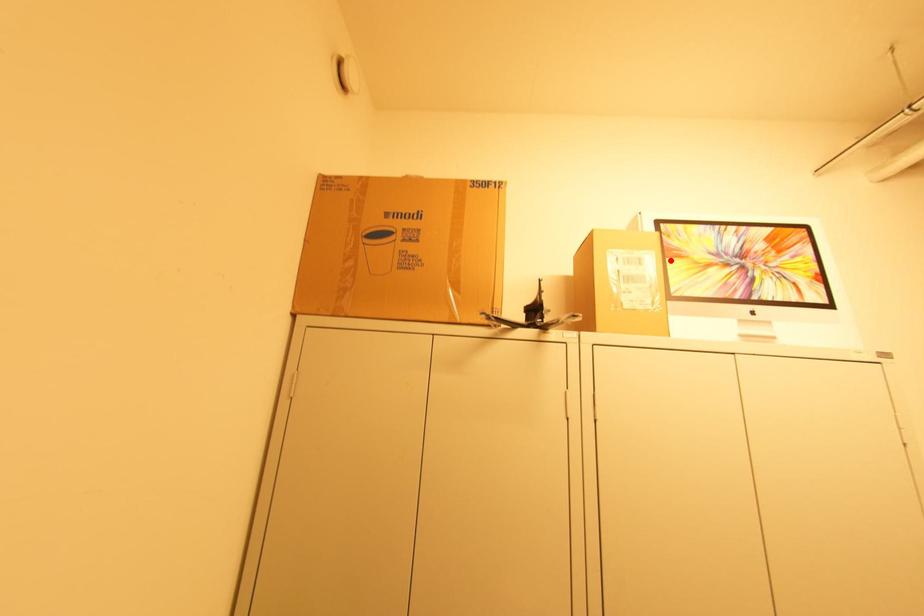
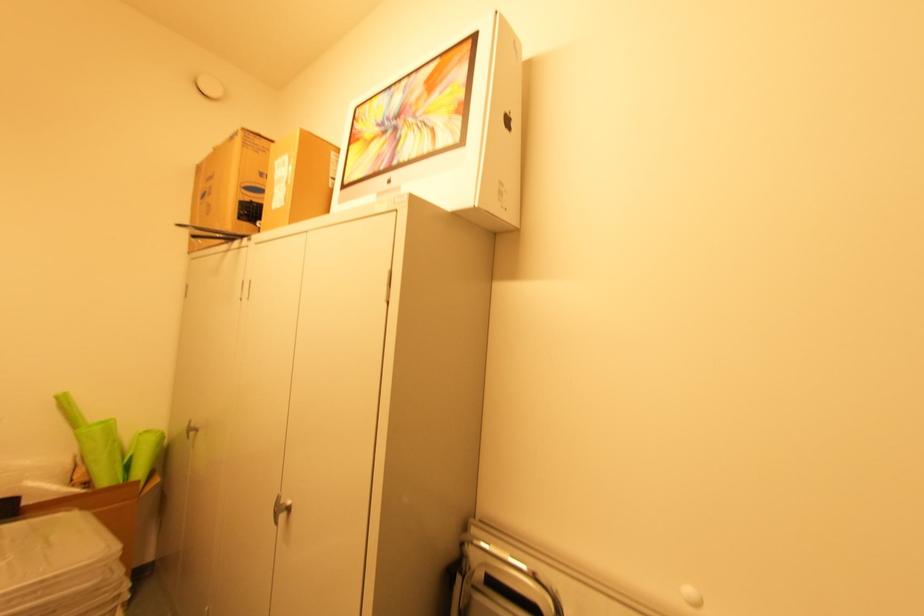
In the second image, find the point that corresponds to the highlighted location in the first image.

(353, 148)